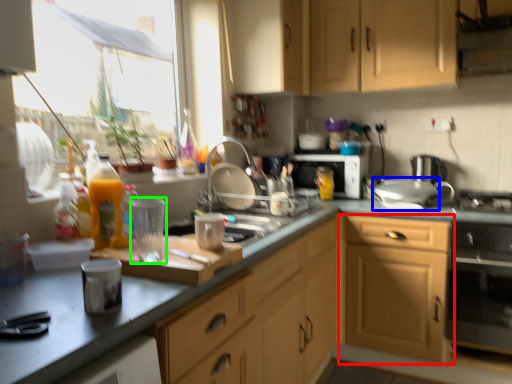
Question: Based on their relative distances, which object is farther from cabinetry (highlighted by a red box)? Choose from appliance (highlighted by a blue box) and appliance (highlighted by a green box).

Choices:
 (A) appliance
 (B) appliance

Answer: (B)